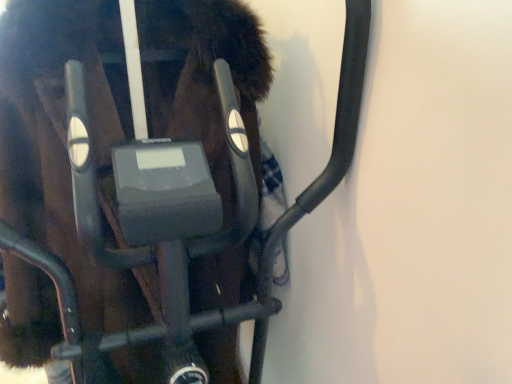
Measure the distance between metallic black exercise bike at center and camera.

The depth of metallic black exercise bike at center is 24.43 inches.

What do you see at coordinates (153, 189) in the screenshot? The height and width of the screenshot is (384, 512). I see `metallic black exercise bike at center` at bounding box center [153, 189].

Locate an element on the screen. This screenshot has height=384, width=512. metallic black exercise bike at center is located at coordinates (153, 189).

I want to click on metallic black exercise bike at center, so click(153, 189).